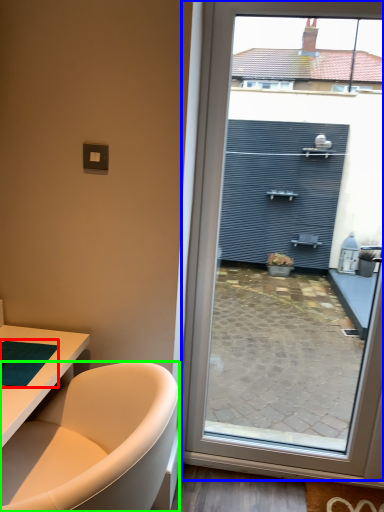
Question: Estimate the real-world distances between objects in this image. Which object is closer to yoga mat (highlighted by a red box), window (highlighted by a blue box) or bathtub (highlighted by a green box)?

Choices:
 (A) window
 (B) bathtub

Answer: (B)